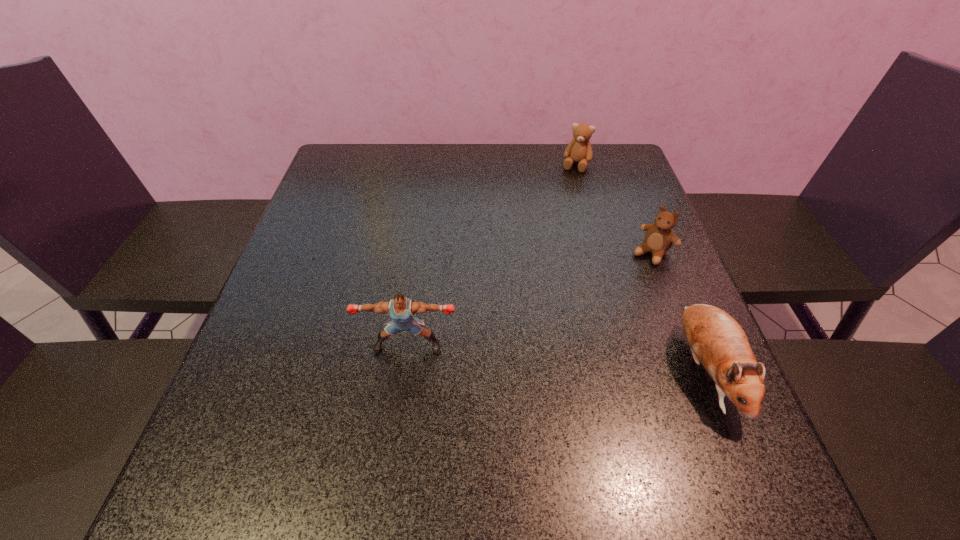
The width and height of the screenshot is (960, 540). In the image, there is a desktop. Find the location of `blank space at the near edge`. blank space at the near edge is located at coordinates (557, 439).

In the image, there is a desktop. At what (x,y) coordinates should I click in order to perform the action: click on vacant space at the left edge. Please return your answer as a coordinate pair (x, y). The image size is (960, 540). Looking at the image, I should click on (265, 361).

The width and height of the screenshot is (960, 540). In the image, there is a desktop. In order to click on free space at the right edge in this screenshot , I will do `click(662, 319)`.

This screenshot has height=540, width=960. Identify the location of free space at the far left corner of the desktop. pos(374,161).

In the image, there is a desktop. At what (x,y) coordinates should I click in order to perform the action: click on vacant space at the near left corner. Please return your answer as a coordinate pair (x, y). The image size is (960, 540). Looking at the image, I should click on pos(210,441).

In order to click on vacant space at the far right corner of the desktop in this screenshot , I will do `click(585, 184)`.

You are a GUI agent. You are given a task and a screenshot of the screen. Output one action in this format:
    pyautogui.click(x=<x>, y=<y>)
    Task: Click on the free point at the near right corner
    
    Given the screenshot: What is the action you would take?
    pyautogui.click(x=687, y=428)

This screenshot has height=540, width=960. Find the location of `vacant area that lies between the hamster and the puncher`. vacant area that lies between the hamster and the puncher is located at coordinates (557, 358).

Where is `unoccupied position between the tallest object and the hamster`? unoccupied position between the tallest object and the hamster is located at coordinates (557, 358).

You are a GUI agent. You are given a task and a screenshot of the screen. Output one action in this format:
    pyautogui.click(x=<x>, y=<y>)
    Task: Click on the vacant area that lies between the hamster and the puncher
    The width and height of the screenshot is (960, 540).
    Given the screenshot: What is the action you would take?
    pyautogui.click(x=557, y=358)